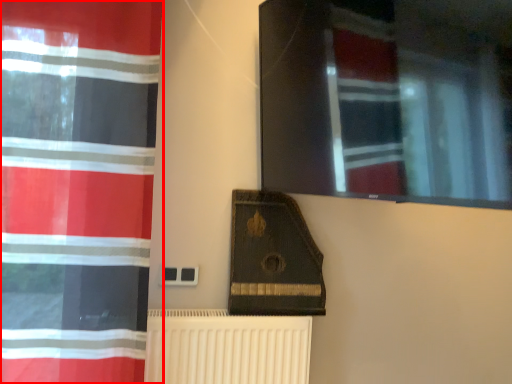
Question: In this image, where is curtain (annotated by the red box) located relative to radiator?

Choices:
 (A) left
 (B) right

Answer: (A)